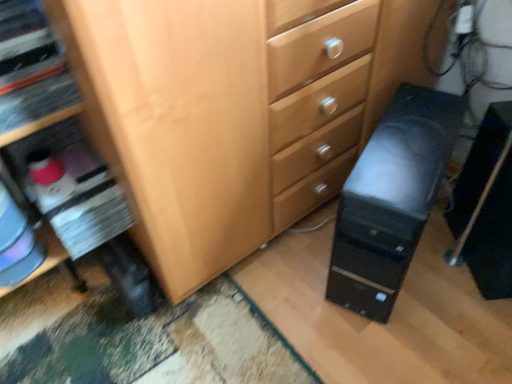
Where is `free space that is in between black plastic computer tower at lower right, which is the first computer tower from left to right, and black plastic computer tower at lower right, the 2th computer tower positioned from the left`? This screenshot has width=512, height=384. free space that is in between black plastic computer tower at lower right, which is the first computer tower from left to right, and black plastic computer tower at lower right, the 2th computer tower positioned from the left is located at coordinates (436, 288).